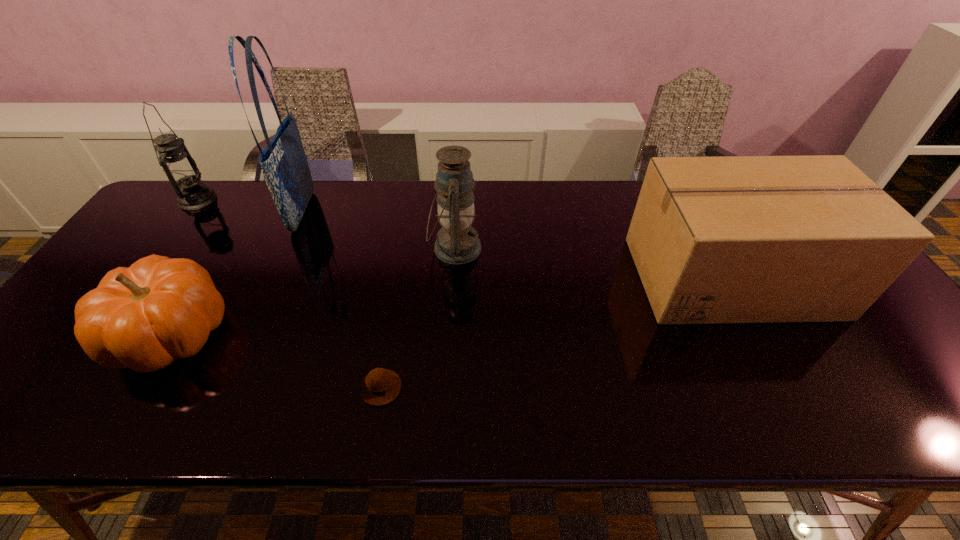
Find the location of a particular element. This screenshot has width=960, height=540. blank space located on the front of the left oil lamp is located at coordinates (166, 242).

Where is `free space located on the left of the nearer oil lamp`? free space located on the left of the nearer oil lamp is located at coordinates (302, 248).

Image resolution: width=960 pixels, height=540 pixels. I want to click on free space located on the right of the box, so click(857, 277).

I want to click on free space located 0.170m on the right of the fifth tallest object, so click(x=300, y=334).

Where is `free space located on the left of the fourth object from left to right`? This screenshot has height=540, width=960. free space located on the left of the fourth object from left to right is located at coordinates (216, 388).

The width and height of the screenshot is (960, 540). What are the coordinates of `shopping bag that is at the far edge` in the screenshot? It's located at (285, 168).

Identify the location of object located in the near edge section of the desktop. (381, 386).

The image size is (960, 540). I want to click on oil lamp at the left edge, so click(181, 170).

Locate an element on the screen. pumpkin that is positioned at the left edge is located at coordinates (159, 309).

Where is `object at the right edge`? This screenshot has width=960, height=540. object at the right edge is located at coordinates (737, 239).